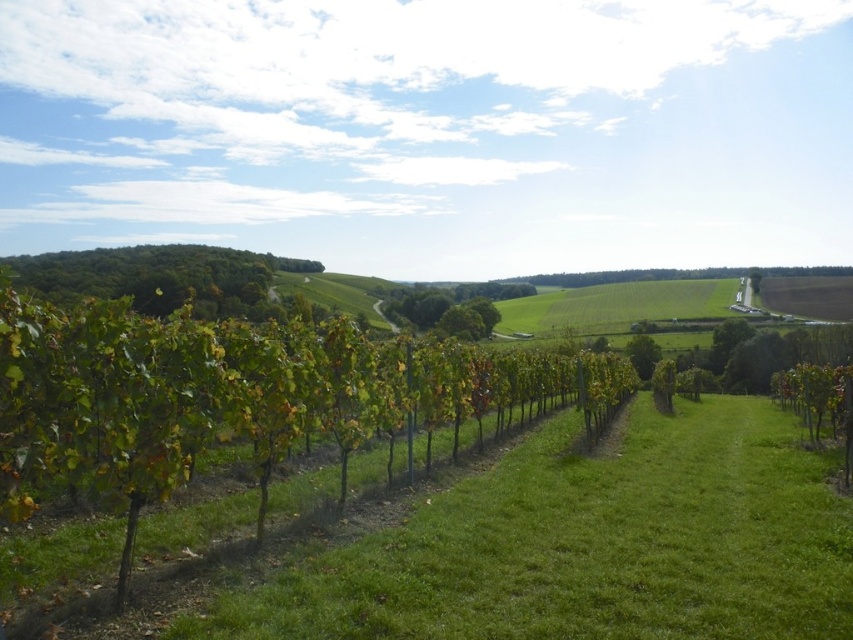
You are standing at the origin point of the image. Which direction should you move to reach the green leafy vines at center?

The green leafy vines at center are located at coordinates point [242,396], so you should move towards the right and upward to reach them.